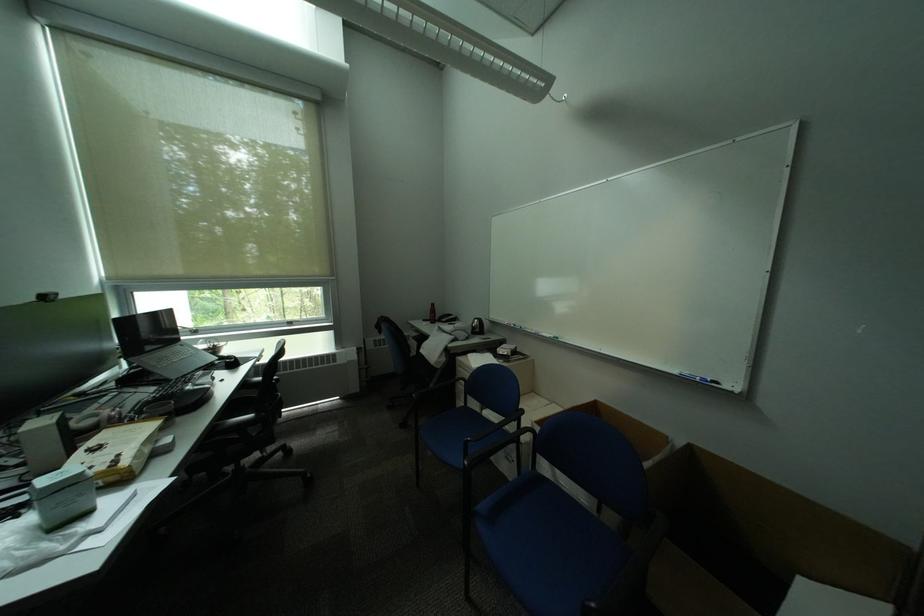
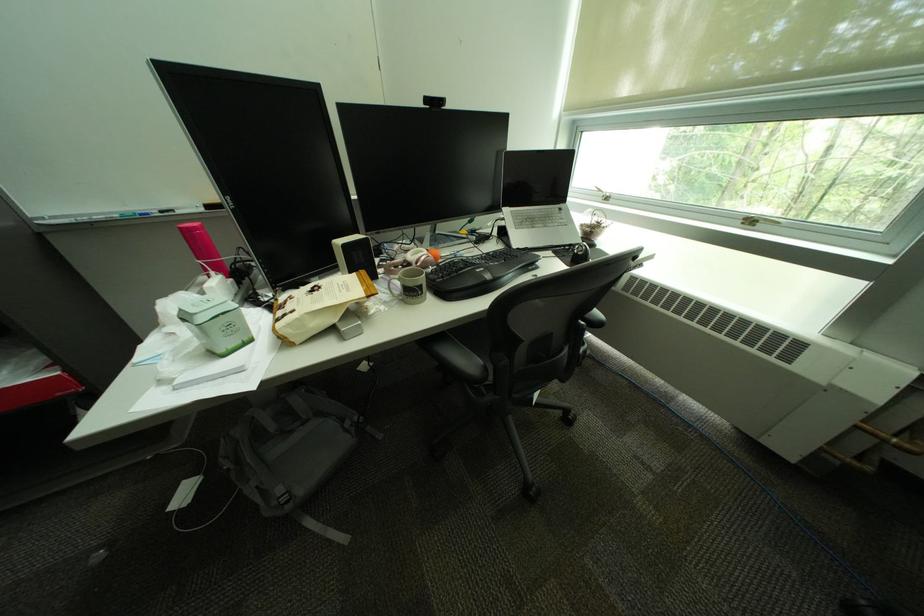
Find the pixel in the second image that matches pixel 147 366 in the first image.

(514, 217)